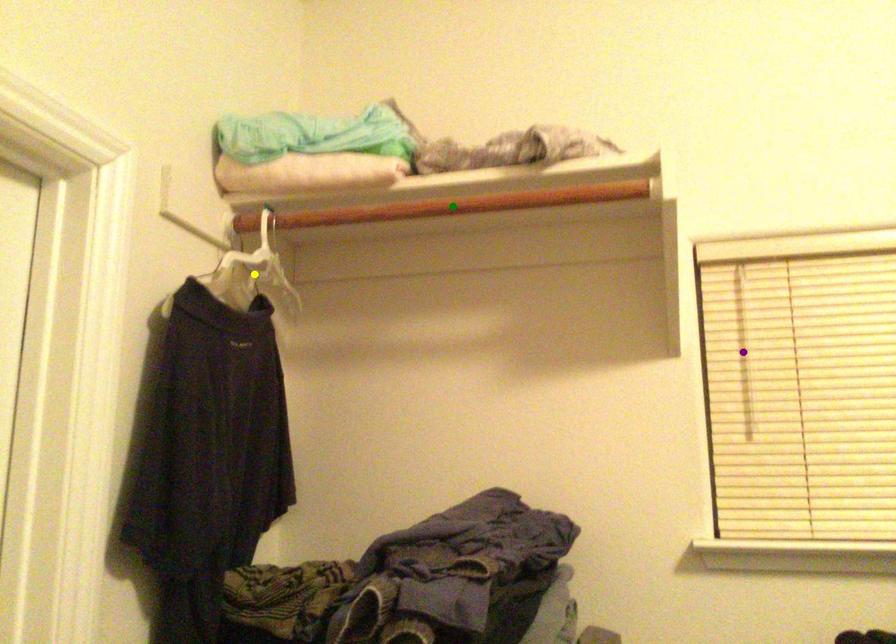
Order these from nearest to farthest:
purple point, yellow point, green point

1. green point
2. purple point
3. yellow point